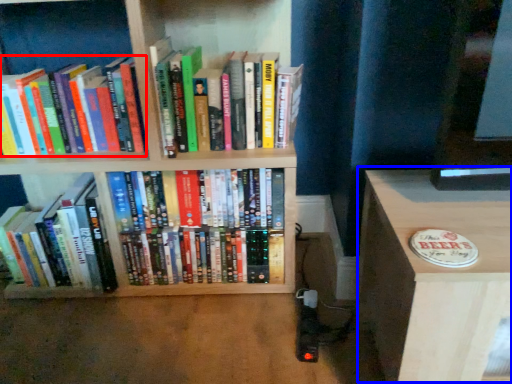
Question: Which point is further to the camera, book (highlighted by a red box) or table (highlighted by a blue box)?

Choices:
 (A) book
 (B) table

Answer: (A)